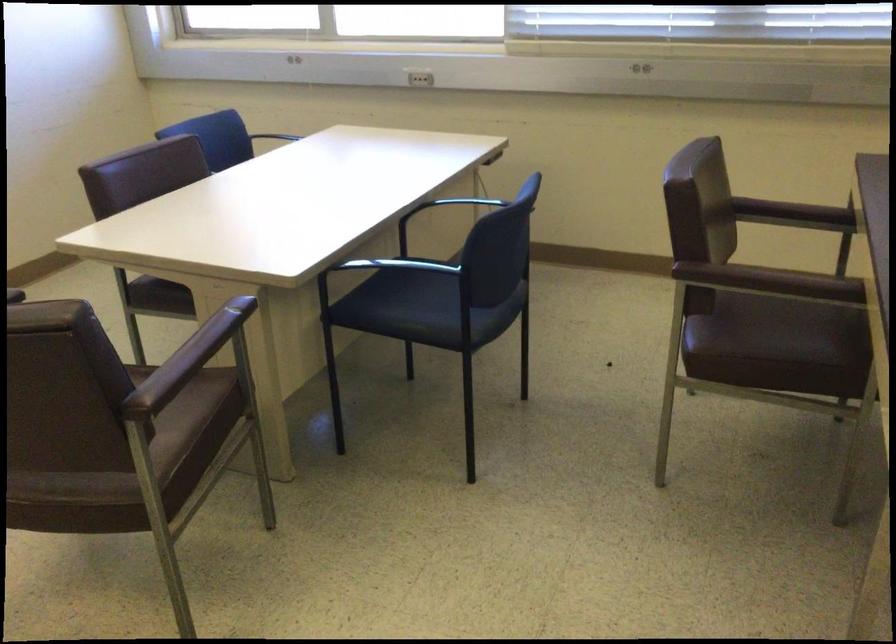
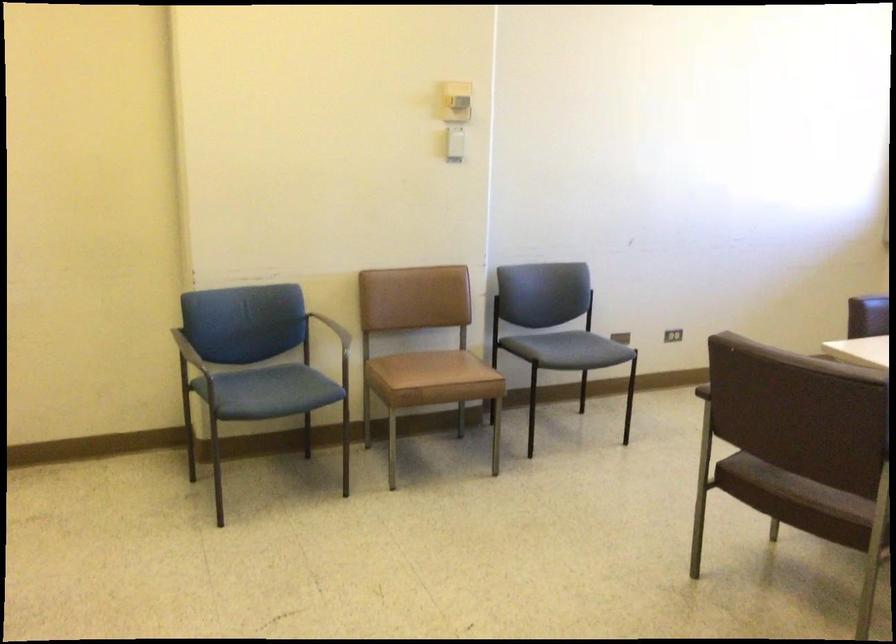
Question: How did the camera likely rotate?

Choices:
 (A) Left
 (B) Right
 (C) Up
 (D) Down

Answer: (A)